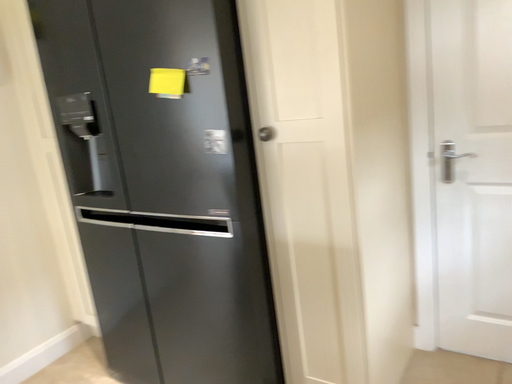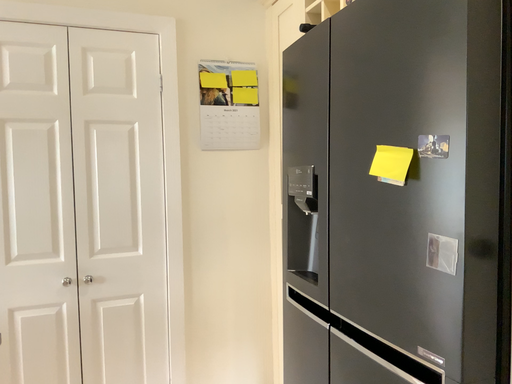
Question: How did the camera likely rotate when shooting the video?

Choices:
 (A) rotated left
 (B) rotated right

Answer: (A)